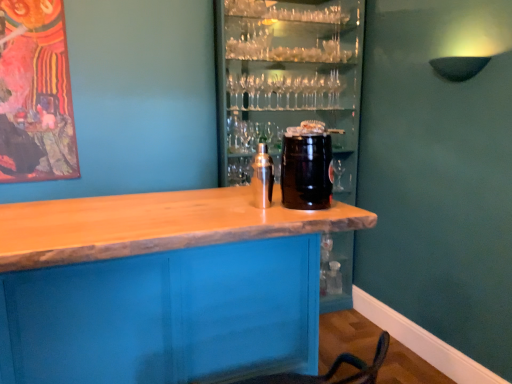
Question: Is wooden table at center bigger or smaller than satin silver shaker at center, the first beverage in the left-to-right sequence?

Choices:
 (A) small
 (B) big

Answer: (B)

Question: Would you say wooden table at center is to the left or to the right of satin silver shaker at center, which ranks as the 2th beverage in right-to-left order, in the picture?

Choices:
 (A) right
 (B) left

Answer: (B)

Question: Which object is positioned closest to the black matte keg at center, the first beverage from the right?

Choices:
 (A) satin silver shaker at center, which ranks as the 2th beverage in right-to-left order
 (B) wooden at center
 (C) wooden table at center

Answer: (A)

Question: Estimate the real-world distances between objects in this image. Which object is closer to the wooden table at center?

Choices:
 (A) black matte keg at center, acting as the 2th beverage starting from the left
 (B) satin silver shaker at center, the first beverage in the left-to-right sequence
 (C) wooden at center

Answer: (B)